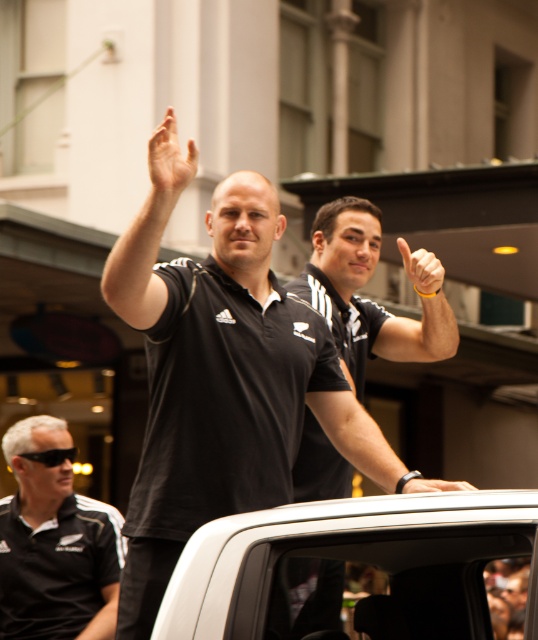
Question: Does black matte shirt at center come in front of black matte shirt at lower left?

Choices:
 (A) no
 (B) yes

Answer: (B)

Question: Which point is closer to the camera taking this photo?

Choices:
 (A) (196, 150)
 (B) (287, 547)
 (C) (51, 502)
 (D) (257, 413)

Answer: (B)

Question: Which of these objects is positioned farthest from the black matte shirt at center?

Choices:
 (A) skinny flesh-toned hand at upper center
 (B) black matte polo shirt at center
 (C) black matte wristband at upper center

Answer: (C)

Question: Among these objects, which one is nearest to the camera?

Choices:
 (A) white matte car at upper center
 (B) skinny flesh-toned hand at upper center
 (C) yellow rubber band at upper right
 (D) black matte shirt at center

Answer: (A)

Question: Does black matte polo shirt at center have a lesser width compared to yellow rubber band at upper right?

Choices:
 (A) no
 (B) yes

Answer: (A)

Question: Does black matte polo shirt at center appear under black matte wristband at upper center?

Choices:
 (A) yes
 (B) no

Answer: (B)